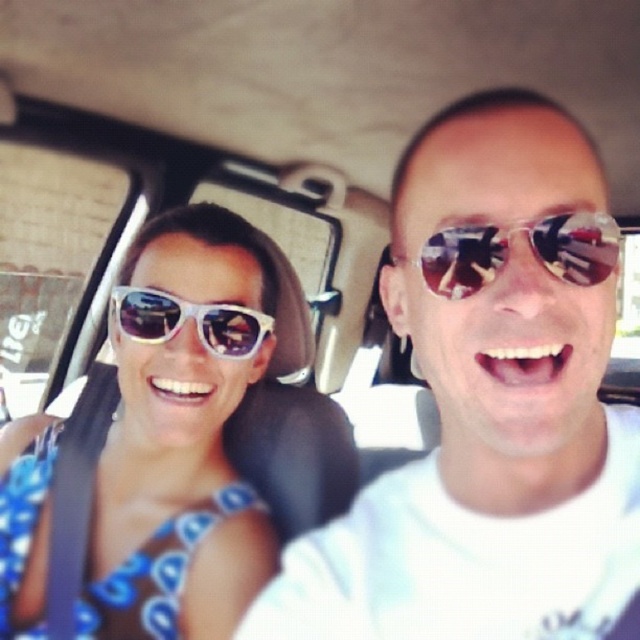
You are a passenger in the van and want to hand the shiny reflective sunglasses at center to the driver who is wearing the white plastic sunglasses at left. Can you directly hand it to them without moving your seat?

The shiny reflective sunglasses at center is positioned over the white plastic sunglasses at left, so you can directly hand it to the driver without needing to move your seat.

You are a customer at an eyewear store and see two pairs of sunglasses displayed on a shelf. The white glossy sunglasses at upper left and the white plastic sunglasses at left are both on the shelf. Which pair has a bigger frame size?

The white glossy sunglasses at upper left has a larger size compared to the white plastic sunglasses at left.

You are a photographer standing 1.5 meters away from the vehicle. You want to take a closeup photo of the shiny reflective sunglasses at center. Is the distance sufficient to capture the sunglasses clearly?

The shiny reflective sunglasses at center is 41.35 centimeters from the viewer. Since the photographer is standing 1.5 meters away, which is 150 centimeters, the distance is sufficient to capture the sunglasses clearly as they are within range.